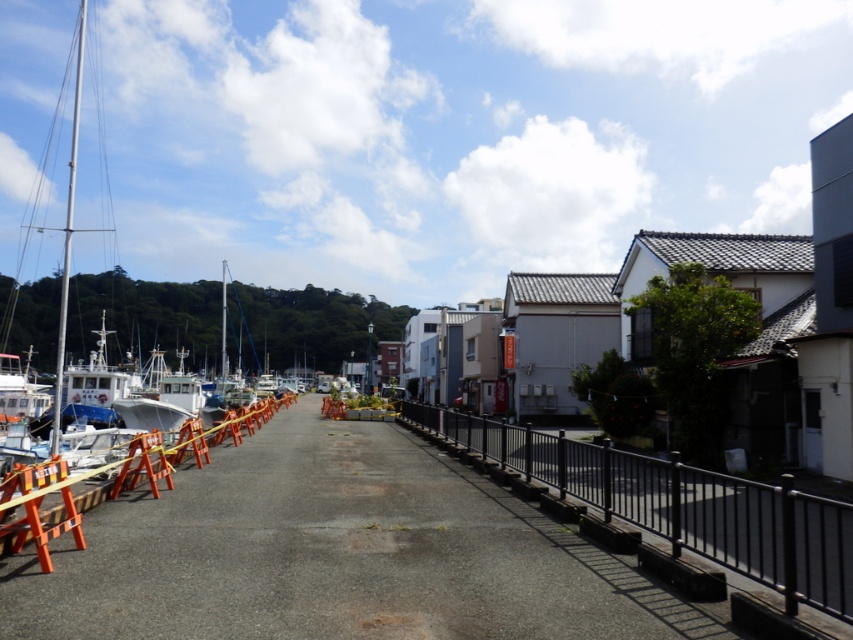
Question: Which of the following is the closest to the observer?

Choices:
 (A) smooth asphalt path at center
 (B) black metal fence at right

Answer: (B)

Question: Can you confirm if smooth asphalt path at center is smaller than black metal fence at right?

Choices:
 (A) no
 (B) yes

Answer: (B)

Question: Does smooth asphalt path at center have a larger size compared to black metal fence at right?

Choices:
 (A) no
 (B) yes

Answer: (A)

Question: Among these objects, which one is farthest from the camera?

Choices:
 (A) smooth asphalt path at center
 (B) black metal fence at right

Answer: (A)

Question: Is smooth asphalt path at center positioned behind black metal fence at right?

Choices:
 (A) no
 (B) yes

Answer: (B)